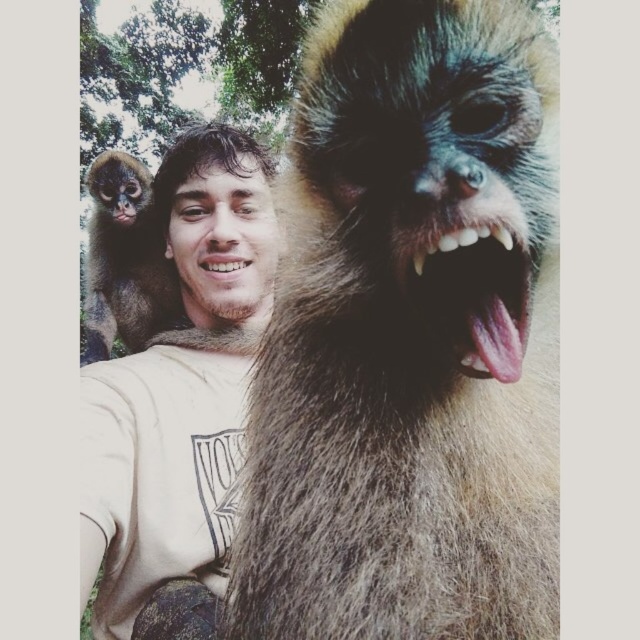
Question: Is matte white t-shirt at upper left positioned at the back of brown furry monkey at upper left?

Choices:
 (A) yes
 (B) no

Answer: (B)

Question: Is matte white t-shirt at upper left closer to the viewer compared to brown furry monkey at upper left?

Choices:
 (A) yes
 (B) no

Answer: (A)

Question: Does matte white t-shirt at upper left appear under brown furry monkey at upper left?

Choices:
 (A) yes
 (B) no

Answer: (A)

Question: Which point is closer to the camera taking this photo?

Choices:
 (A) (132, 266)
 (B) (438, 220)
 (C) (166, 282)

Answer: (B)

Question: Estimate the real-world distances between objects in this image. Which object is closer to the fuzzy brown fur monkey at upper left?

Choices:
 (A) matte white t-shirt at upper left
 (B) brown furry monkey at upper left

Answer: (A)

Question: Which object appears closest to the camera in this image?

Choices:
 (A) matte white t-shirt at upper left
 (B) fuzzy brown fur monkey at upper left

Answer: (B)